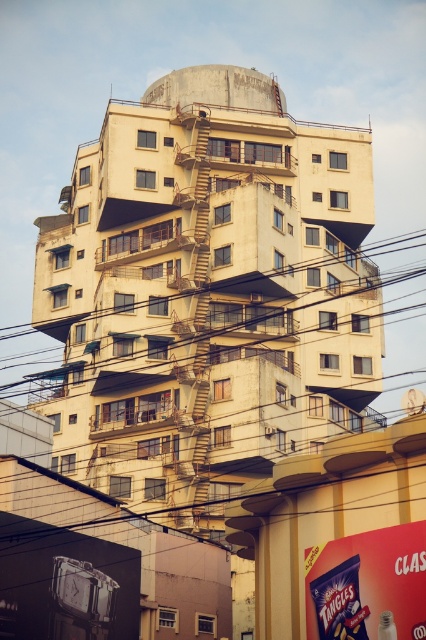
Based on the photo, you are a maintenance worker inspecting the building. You notice the brown wire at center and the yellow metal fire escape at center. Which object is shorter in height?

The brown wire at center is shorter than the yellow metal fire escape at center.

You are a maintenance worker needing to inspect both the brown wire at center and the yellow metal fire escape at center. From your current position, which object is located to the left?

The brown wire at center is positioned on the left side of the yellow metal fire escape at center, so the brown wire at center is to the left.

You are a maintenance worker needing to reach both the brown wire at center and the yellow metal fire escape at center. Given that your ladder is 70 meters long, can you safely reach both objects with the ladder from your current position?

The brown wire at center is 69.41 meters away from the yellow metal fire escape at center. Since the ladder is 70 meters long, it is just long enough to reach both objects from your current position, provided you position it correctly between them.